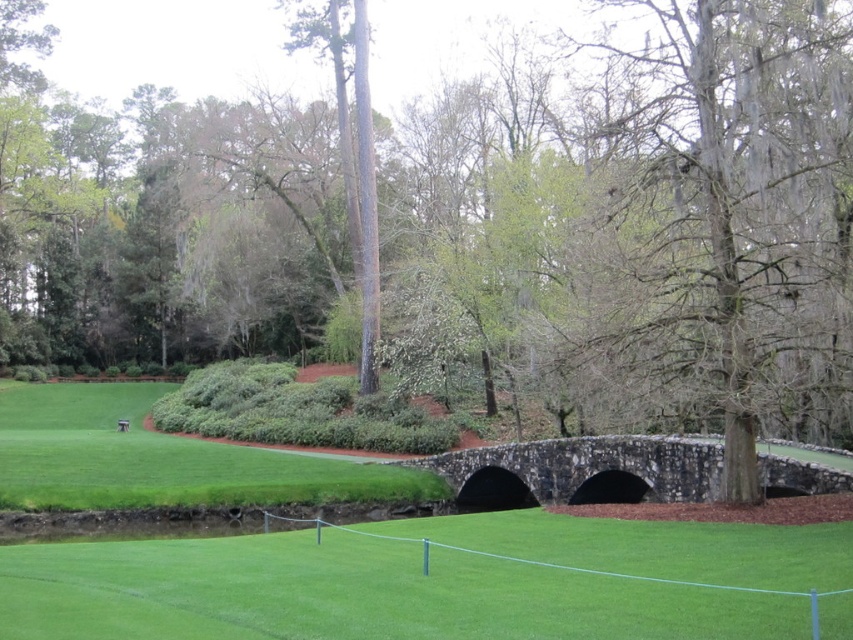
Does gray mossy tree trunk at center appear on the right side of green smooth grass at center?

Indeed, gray mossy tree trunk at center is positioned on the right side of green smooth grass at center.

Is gray mossy tree trunk at center below green smooth grass at center?

Incorrect, gray mossy tree trunk at center is not positioned below green smooth grass at center.

Who is more forward, (815, 241) or (821, 573)?

Positioned in front is point (821, 573).

Find the location of a particular element. gray mossy tree trunk at center is located at coordinates (732, 212).

Who is positioned more to the left, green smooth grass at center or dark gray stone bridge at center?

green smooth grass at center

Is green smooth grass at center wider than dark gray stone bridge at center?

Indeed, green smooth grass at center has a greater width compared to dark gray stone bridge at center.

The height and width of the screenshot is (640, 853). What do you see at coordinates (434, 582) in the screenshot?
I see `green smooth grass at center` at bounding box center [434, 582].

The height and width of the screenshot is (640, 853). Find the location of `green smooth grass at center`. green smooth grass at center is located at coordinates (434, 582).

Can you confirm if gray mossy tree trunk at center is positioned below dark gray stone bridge at center?

No.

Between gray mossy tree trunk at center and dark gray stone bridge at center, which one is positioned lower?

dark gray stone bridge at center is below.

Describe the element at coordinates (732, 212) in the screenshot. I see `gray mossy tree trunk at center` at that location.

You are a GUI agent. You are given a task and a screenshot of the screen. Output one action in this format:
    pyautogui.click(x=<x>, y=<y>)
    Task: Click on the gray mossy tree trunk at center
    The width and height of the screenshot is (853, 640).
    Given the screenshot: What is the action you would take?
    pyautogui.click(x=732, y=212)